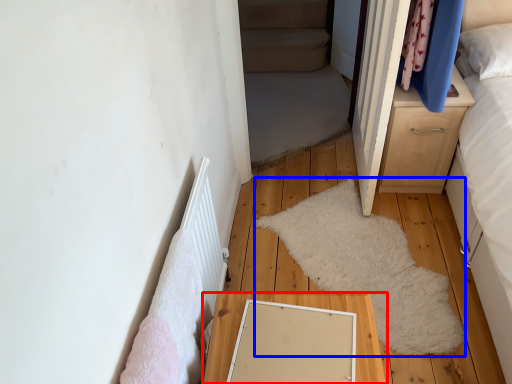
Question: Among these objects, which one is farthest to the camera, table (highlighted by a red box) or mat (highlighted by a blue box)?

Choices:
 (A) table
 (B) mat

Answer: (B)